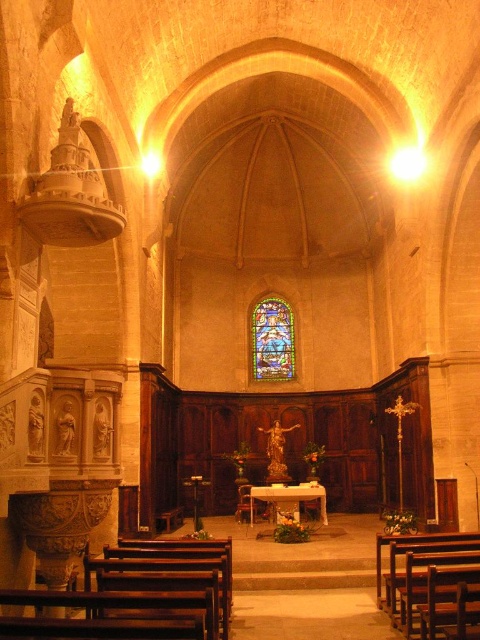
Question: From the image, what is the correct spatial relationship of stained glass window at center in relation to white marble altar at center?

Choices:
 (A) left
 (B) right

Answer: (A)

Question: Is stained glass window at center above white marble altar at center?

Choices:
 (A) no
 (B) yes

Answer: (B)

Question: Is stained glass window at center further to camera compared to white marble altar at center?

Choices:
 (A) no
 (B) yes

Answer: (B)

Question: Which point appears closest to the camera in this image?

Choices:
 (A) (298, 499)
 (B) (255, 344)

Answer: (A)

Question: Which object is farther from the camera taking this photo?

Choices:
 (A) white marble altar at center
 (B) stained glass window at center

Answer: (B)